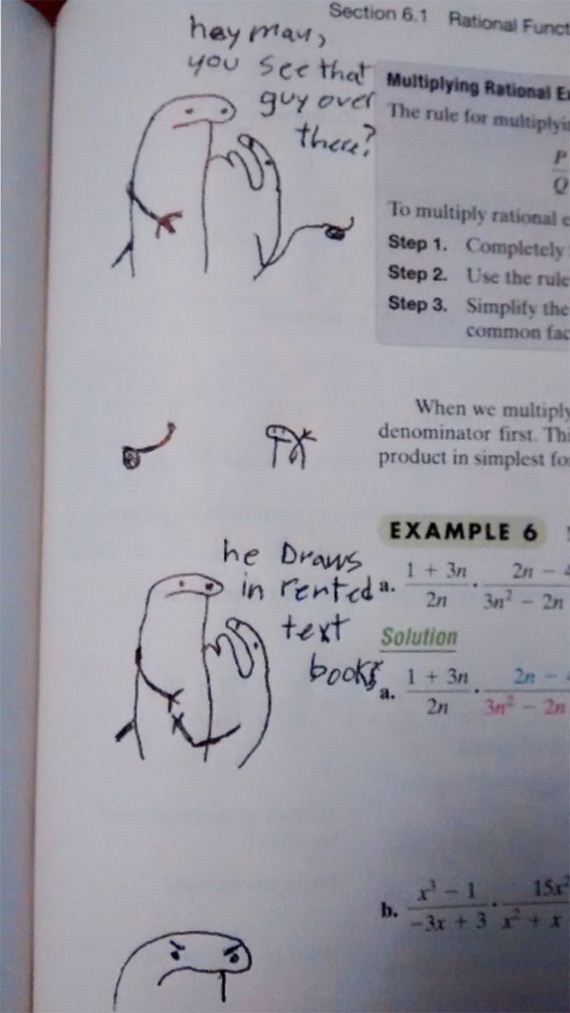
You are a GUI agent. You are given a task and a screenshot of the screen. Output one action in this format:
    pyautogui.click(x=<x>, y=<y>)
    Task: Click on the small drawings
    This screenshot has height=1013, width=570.
    Given the screenshot: What is the action you would take?
    pyautogui.click(x=153, y=446), pyautogui.click(x=283, y=443)